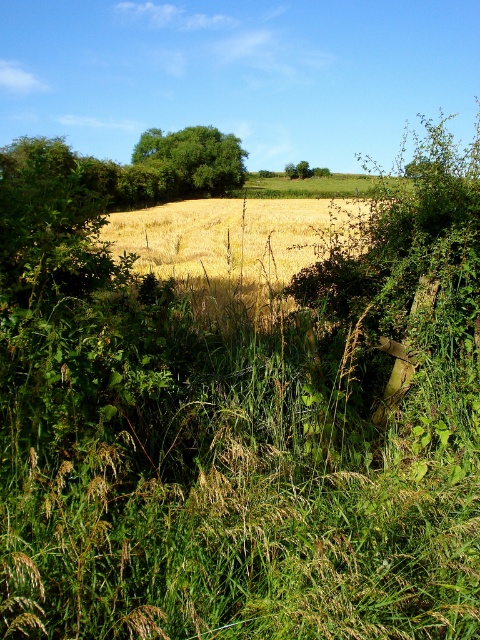
You are standing in a rural landscape and want to take a photo of the golden dry grass at center and the green leafy tree at center. Which object should you focus on first if you want both to be in sharp focus?

The golden dry grass at center is closer to the viewer than the green leafy tree at center. To have both in sharp focus, focus on the green leafy tree at center since it is farther away, ensuring the depth of field captures both.

You are a farmer checking the health of your crops. You notice the golden dry grass at center and the green leafy tree at center in your field. Which of these two plants is bigger in size?

The golden dry grass at center has a larger size compared to the green leafy tree at center.